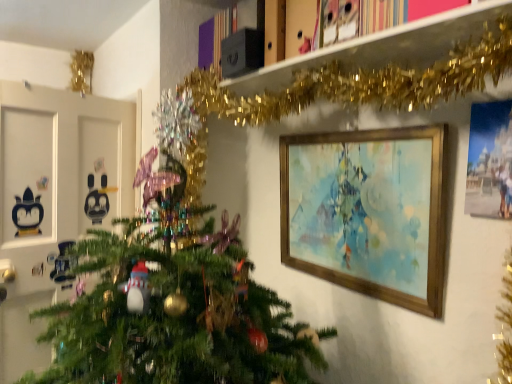
Question: Which is correct: wooden picture frame at upper right, marked as the second picture frame in a right-to-left arrangement, is inside gold tinsel garland at upper center, or outside of it?

Choices:
 (A) inside
 (B) outside

Answer: (B)

Question: Based on their positions, is wooden picture frame at upper right, marked as the second picture frame in a right-to-left arrangement, located to the left or right of gold tinsel garland at upper center?

Choices:
 (A) left
 (B) right

Answer: (B)

Question: Estimate the real-world distances between objects in this image. Which object is farther from the matte blue painting at upper right, positioned as the 1th picture frame in front-to-back order?

Choices:
 (A) gold tinsel garland at upper center
 (B) wooden picture frame at upper right, arranged as the first picture frame when viewed from the back

Answer: (A)

Question: Based on their relative distances, which object is farther from the wooden picture frame at upper right, marked as the second picture frame in a right-to-left arrangement?

Choices:
 (A) matte blue painting at upper right, positioned as the 1th picture frame in front-to-back order
 (B) gold tinsel garland at upper center

Answer: (B)